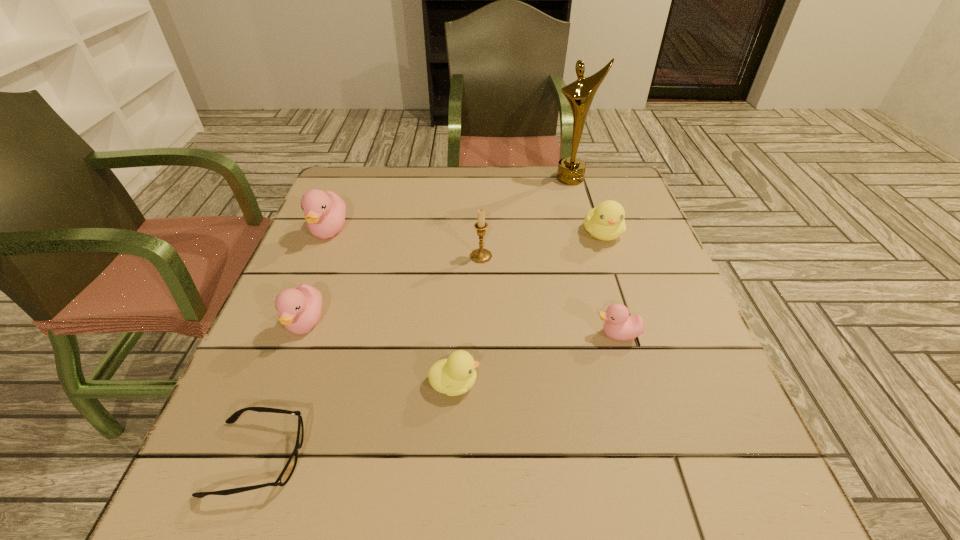
Identify the location of empty space that is in between the biggest pink duckling and the smallest pink duckling. The width and height of the screenshot is (960, 540). (473, 283).

At what (x,y) coordinates should I click in order to perform the action: click on empty space that is in between the smallest pink duckling and the second nearest object. Please return your answer as a coordinate pair (x, y). Looking at the image, I should click on (536, 359).

Where is `free spot between the farther yellow duckling and the tallest duckling`? The height and width of the screenshot is (540, 960). free spot between the farther yellow duckling and the tallest duckling is located at coordinates (466, 232).

This screenshot has height=540, width=960. Identify the location of vacant space that is in between the candle holder and the second smallest pink duckling. (394, 290).

Locate an element on the screen. This screenshot has width=960, height=540. free space that is in between the tallest object and the second smallest pink duckling is located at coordinates (439, 251).

Identify the location of the third closest object to the biggest pink duckling. (454, 376).

The height and width of the screenshot is (540, 960). In order to click on object that is the seventh nearest to the second biggest pink duckling in this screenshot , I will do `click(571, 170)`.

The height and width of the screenshot is (540, 960). I want to click on duckling that can be found as the third closest to the candle holder, so click(x=454, y=376).

Image resolution: width=960 pixels, height=540 pixels. Identify the location of duckling that stands as the fifth closest to the nearest object. (605, 222).

Locate which pink duckling ranks second in proximity to the second biggest pink duckling. Please provide its 2D coordinates. Your answer should be formatted as a tuple, i.e. [(x, y)], where the tuple contains the x and y coordinates of a point satisfying the conditions above.

[(619, 325)]